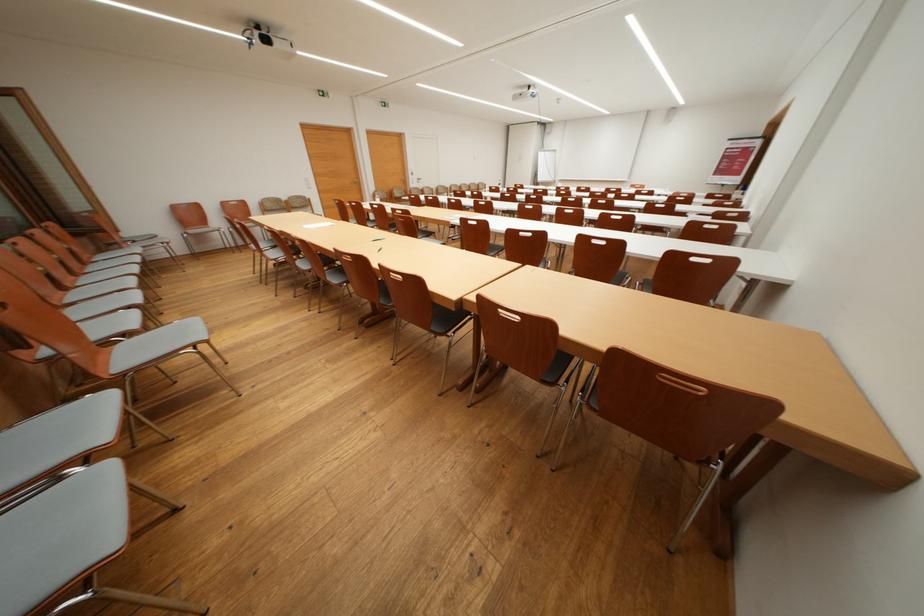
Which object does [317,225] point to?

It refers to a white paper sheet.